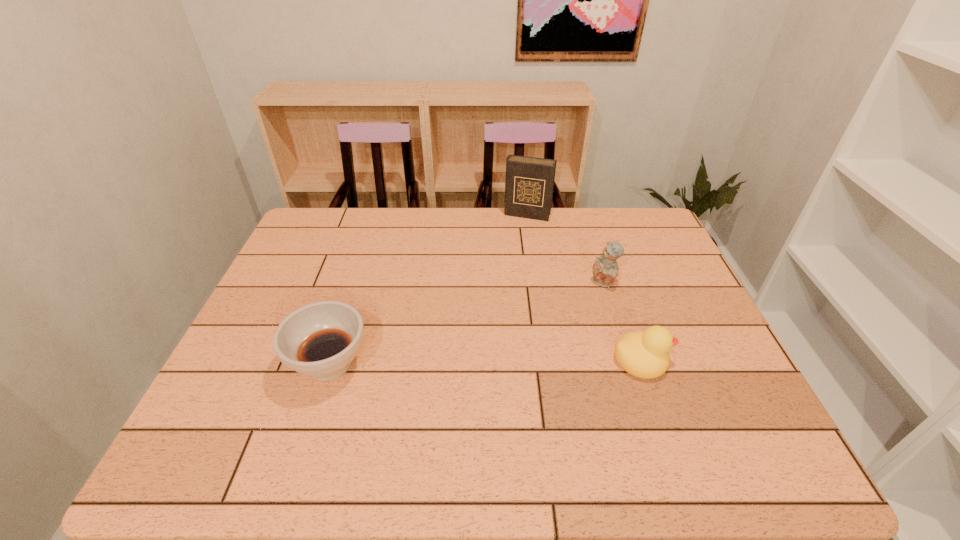
Locate an element on the screen. free space between the leftmost object and the farthest object is located at coordinates (428, 289).

Find the location of a particular element. This screenshot has width=960, height=540. unoccupied position between the third object from right to left and the duckling is located at coordinates (585, 287).

The height and width of the screenshot is (540, 960). I want to click on free space between the teddy bear and the tallest object, so [x=565, y=249].

Identify the location of empty space between the duckling and the farthest object. (585, 287).

Identify which object is the third nearest to the diary. Please provide its 2D coordinates. Your answer should be formatted as a tuple, i.e. [(x, y)], where the tuple contains the x and y coordinates of a point satisfying the conditions above.

[(320, 340)]

Select which object is the second closest to the farthest object. Please provide its 2D coordinates. Your answer should be formatted as a tuple, i.e. [(x, y)], where the tuple contains the x and y coordinates of a point satisfying the conditions above.

[(644, 354)]

Identify the location of vacant space that satisfies the following two spatial constraints: 1. on the front side of the third nearest object; 2. on the face of the duckling. (628, 360).

Identify the location of vacant region that satisfies the following two spatial constraints: 1. on the front side of the duckling; 2. on the face of the second farthest object. (628, 360).

At what (x,y) coordinates should I click in order to perform the action: click on free spot that satisfies the following two spatial constraints: 1. on the front side of the third object from right to left; 2. on the right side of the second tallest object. Please return your answer as a coordinate pair (x, y). The width and height of the screenshot is (960, 540). Looking at the image, I should click on (538, 283).

At what (x,y) coordinates should I click in order to perform the action: click on free space that satisfies the following two spatial constraints: 1. on the back side of the duckling; 2. on the face of the soup bowl. Please return your answer as a coordinate pair (x, y). This screenshot has width=960, height=540. Looking at the image, I should click on (330, 360).